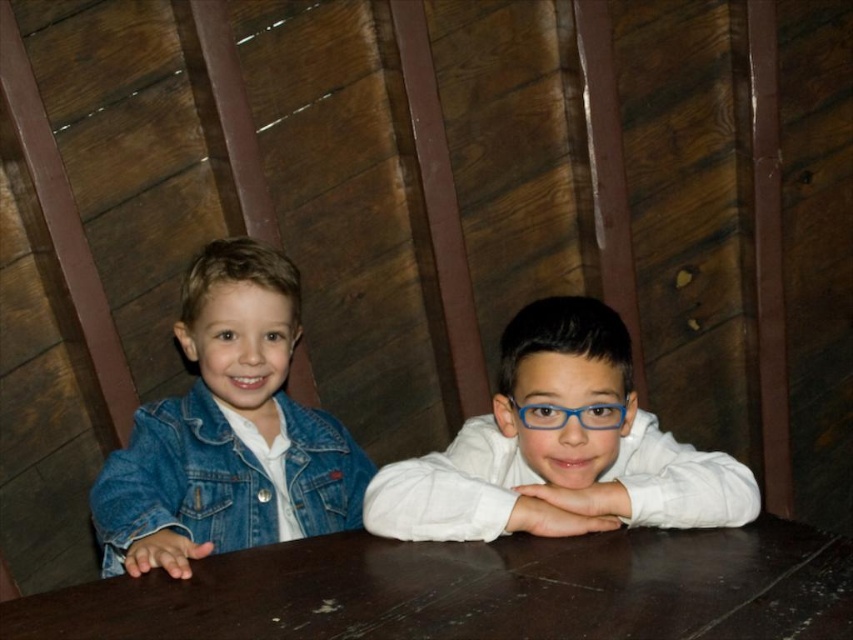
You are standing at the point with coordinates point (351, 472) and want to move to the exit located at point (775, 579). Based on the scene description, is the exit directly behind you or in front of you?

The exit at point (775, 579) is in front of you because it is located in front of point (351, 472) where you are standing.